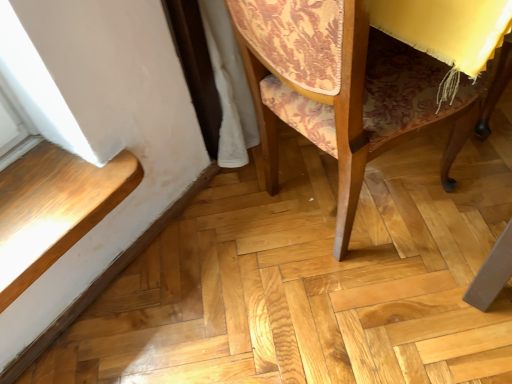
Question: Relative to wooden floor at lower left, is patterned fabric chair at center in front or behind?

Choices:
 (A) front
 (B) behind

Answer: (A)

Question: Considering the positions of patterned fabric chair at center and wooden floor at lower left in the image, is patterned fabric chair at center bigger or smaller than wooden floor at lower left?

Choices:
 (A) big
 (B) small

Answer: (A)

Question: Considering the positions of point (394, 137) and point (76, 168), is point (394, 137) closer or farther from the camera than point (76, 168)?

Choices:
 (A) closer
 (B) farther

Answer: (A)

Question: Considering the positions of wooden floor at lower left and patterned fabric chair at center in the image, is wooden floor at lower left wider or thinner than patterned fabric chair at center?

Choices:
 (A) wide
 (B) thin

Answer: (B)

Question: From a real-world perspective, is wooden floor at lower left positioned above or below patterned fabric chair at center?

Choices:
 (A) below
 (B) above

Answer: (A)

Question: In terms of size, does wooden floor at lower left appear bigger or smaller than patterned fabric chair at center?

Choices:
 (A) small
 (B) big

Answer: (A)

Question: From the image's perspective, is wooden floor at lower left above or below patterned fabric chair at center?

Choices:
 (A) above
 (B) below

Answer: (B)